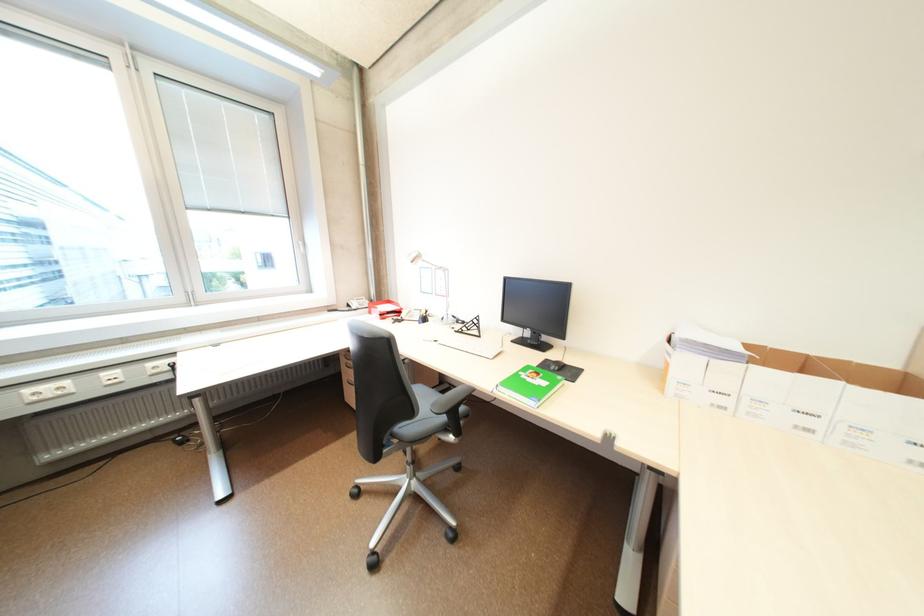
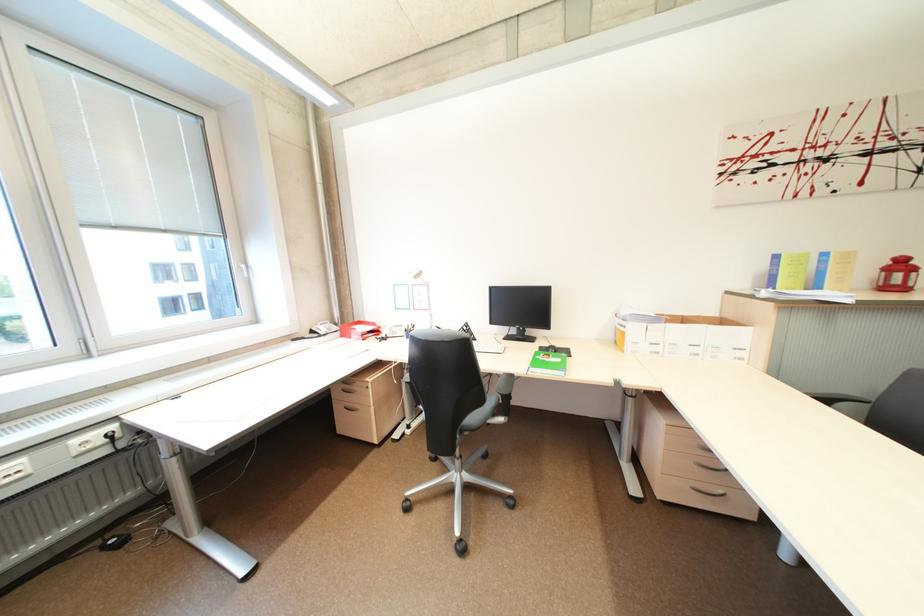
Find the pixel in the second image that matches point (676, 365) in the first image.

(633, 334)